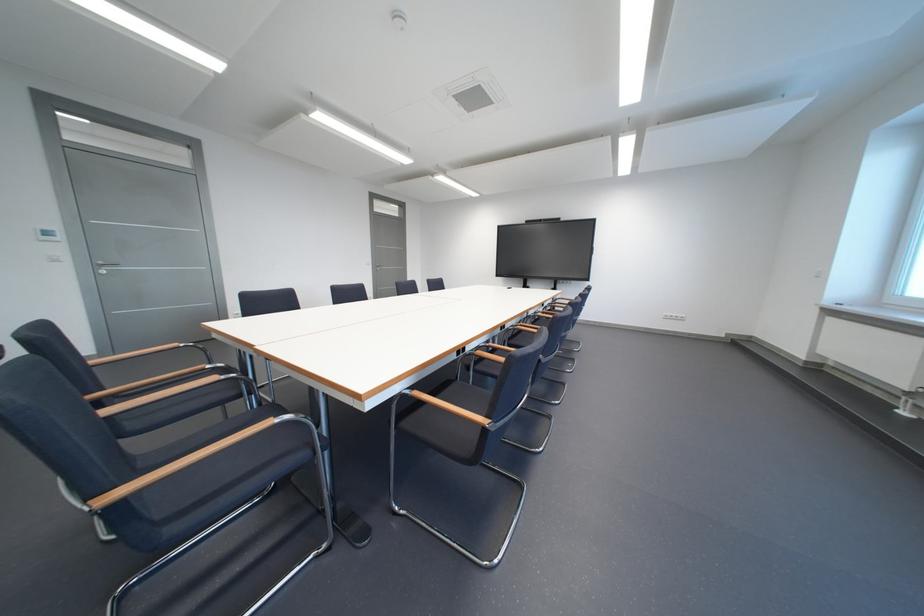
Find where to rest the wooden chair armrest. Please return your answer as a coordinate pair (x, y).

(450, 408)